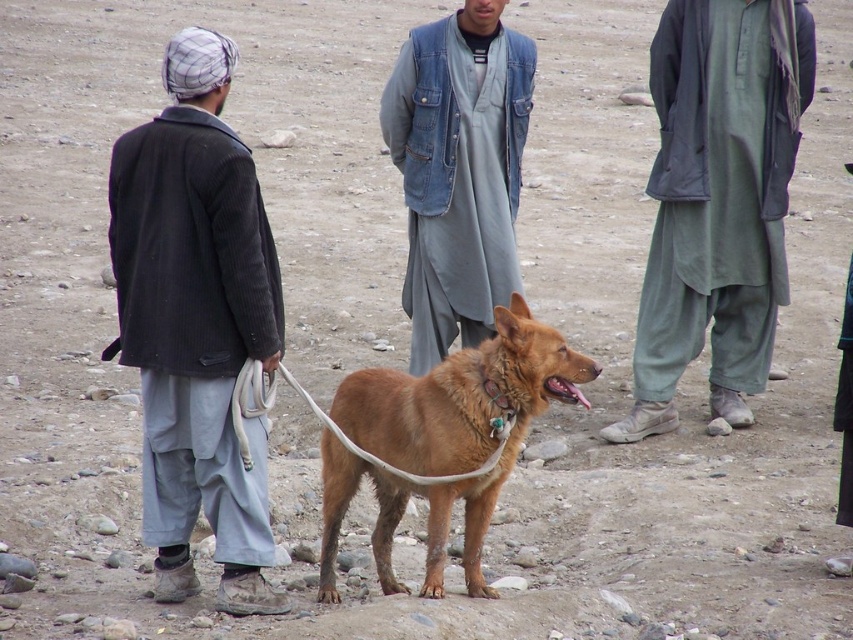
Question: Does green fabric pants at right appear on the right side of denim vest at center?

Choices:
 (A) no
 (B) yes

Answer: (B)

Question: Which object is closer to the camera taking this photo?

Choices:
 (A) green fabric pants at right
 (B) white rope leash at center
 (C) brown furry dog at center
 (D) dark gray corduroy jacket at left

Answer: (C)

Question: Which of the following is the farthest from the observer?

Choices:
 (A) (396, 468)
 (B) (170, 365)
 (C) (381, 440)
 (D) (433, 337)

Answer: (D)

Question: Does denim vest at center appear under brown furry dog at center?

Choices:
 (A) no
 (B) yes

Answer: (A)

Question: Which object is the farthest from the denim vest at center?

Choices:
 (A) brown furry dog at center
 (B) green fabric pants at right

Answer: (A)

Question: Does denim vest at center appear under brown furry dog at center?

Choices:
 (A) no
 (B) yes

Answer: (A)